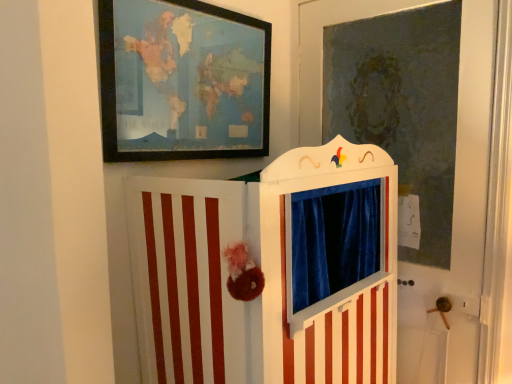
Question: Does white striped puppet theater at center appear on the right side of wooden framed map at upper left?

Choices:
 (A) yes
 (B) no

Answer: (A)

Question: Is white striped puppet theater at center oriented away from wooden framed map at upper left?

Choices:
 (A) yes
 (B) no

Answer: (B)

Question: Can you confirm if white striped puppet theater at center is smaller than wooden framed map at upper left?

Choices:
 (A) yes
 (B) no

Answer: (B)

Question: Would you say white striped puppet theater at center is a long distance from wooden framed map at upper left?

Choices:
 (A) yes
 (B) no

Answer: (B)

Question: Does white striped puppet theater at center have a larger size compared to wooden framed map at upper left?

Choices:
 (A) no
 (B) yes

Answer: (B)

Question: From the image's perspective, is white striped puppet theater at center below wooden framed map at upper left?

Choices:
 (A) no
 (B) yes

Answer: (B)

Question: Does wooden framed map at upper left have a smaller size compared to white striped puppet theater at center?

Choices:
 (A) no
 (B) yes

Answer: (B)

Question: Considering the relative sizes of wooden framed map at upper left and white striped puppet theater at center in the image provided, is wooden framed map at upper left wider than white striped puppet theater at center?

Choices:
 (A) yes
 (B) no

Answer: (B)

Question: From a real-world perspective, is wooden framed map at upper left on white striped puppet theater at center?

Choices:
 (A) no
 (B) yes

Answer: (B)

Question: Would you say wooden framed map at upper left contains white striped puppet theater at center?

Choices:
 (A) no
 (B) yes

Answer: (A)

Question: Is wooden framed map at upper left oriented away from white striped puppet theater at center?

Choices:
 (A) yes
 (B) no

Answer: (B)

Question: Is wooden framed map at upper left next to white striped puppet theater at center?

Choices:
 (A) no
 (B) yes

Answer: (A)

Question: Is velvet blue curtain at upper center oriented away from wooden framed map at upper left?

Choices:
 (A) no
 (B) yes

Answer: (A)